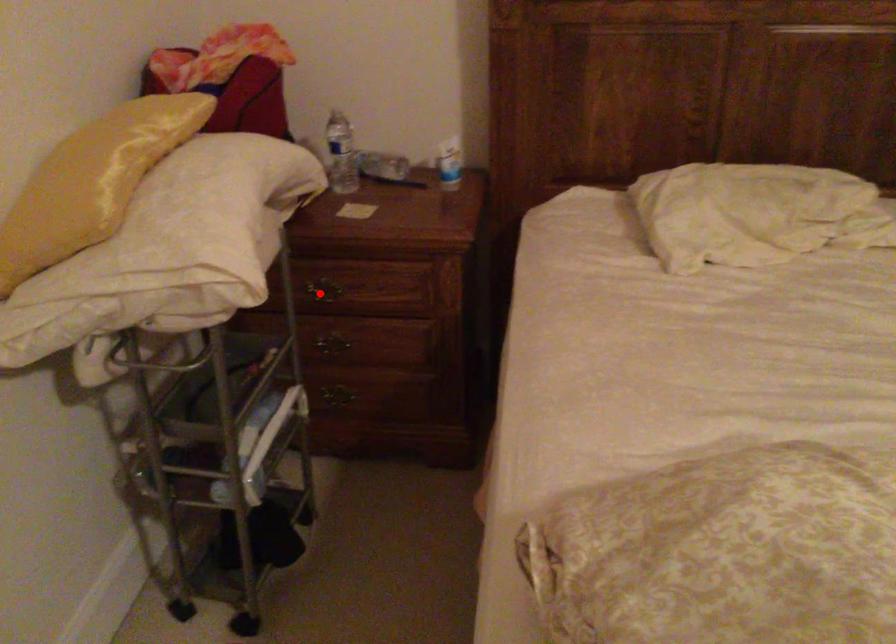
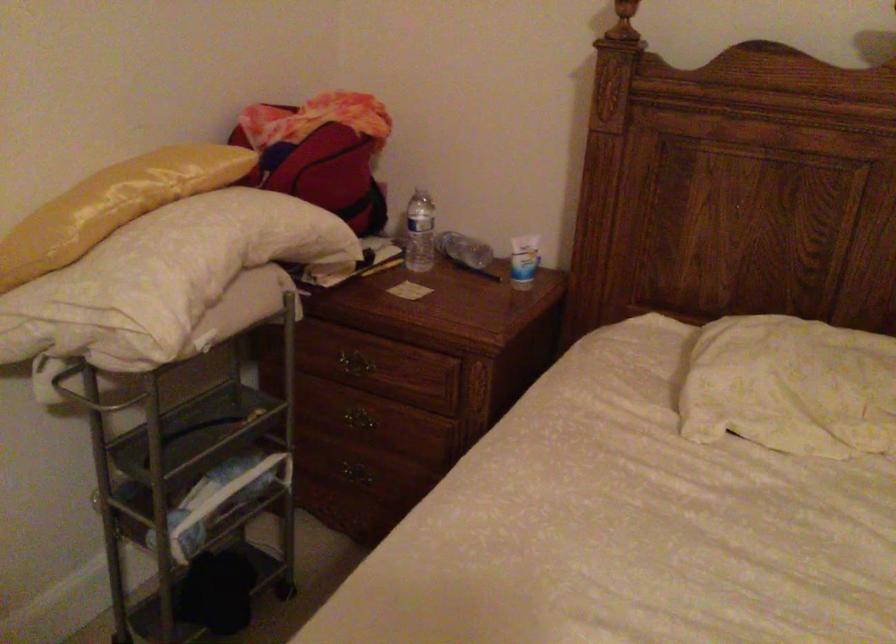
Find the pixel in the second image that matches the highlighted location in the first image.

(350, 365)